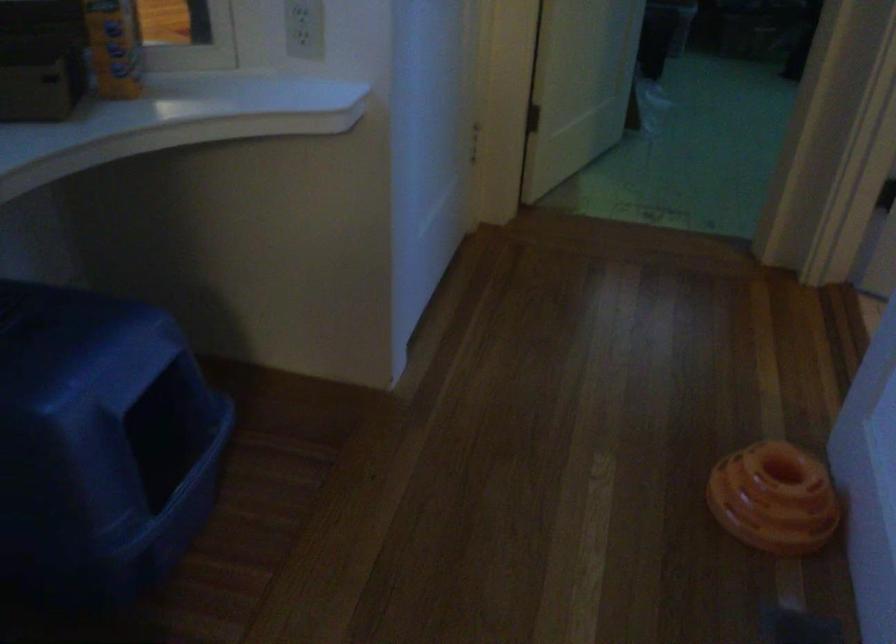
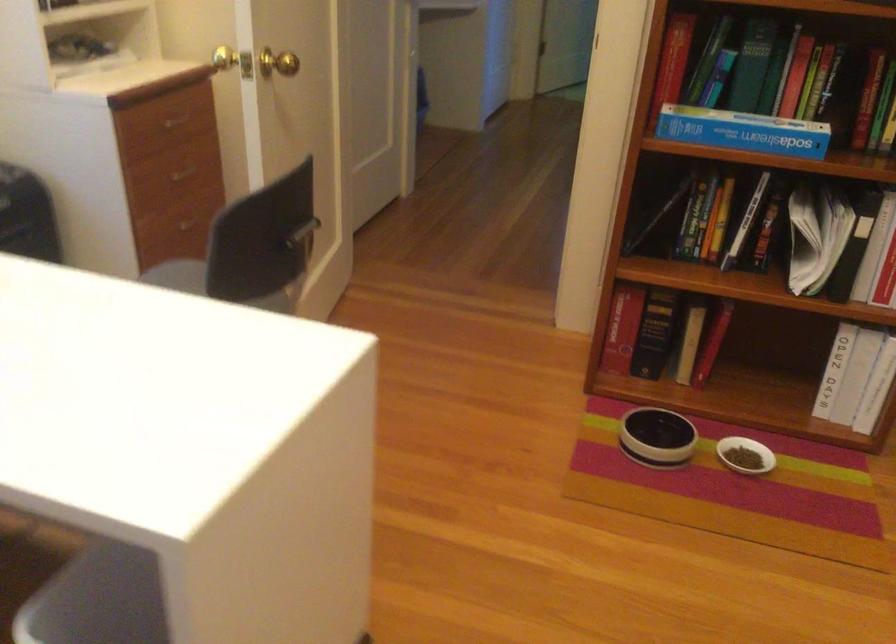
Question: I am providing you with two images of the same scene from different viewpoints. After the viewpoint changes to image2, which objects are now occluded?

Choices:
 (A) orange ring toy
 (B) white locker handle
 (C) red book
 (D) chair back handle

Answer: (A)